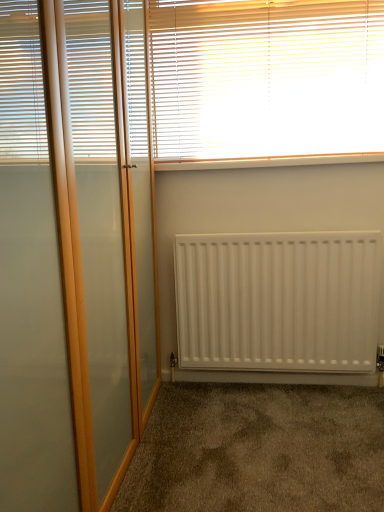
Question: From a real-world perspective, is brown carpet at lower center positioned under white matte radiator at center based on gravity?

Choices:
 (A) no
 (B) yes

Answer: (B)

Question: Does brown carpet at lower center have a greater height compared to white matte radiator at center?

Choices:
 (A) no
 (B) yes

Answer: (A)

Question: Does brown carpet at lower center lie in front of white matte radiator at center?

Choices:
 (A) no
 (B) yes

Answer: (B)

Question: Is brown carpet at lower center facing away from white matte radiator at center?

Choices:
 (A) yes
 (B) no

Answer: (B)

Question: Can you confirm if brown carpet at lower center is shorter than white matte radiator at center?

Choices:
 (A) no
 (B) yes

Answer: (B)

Question: Does point (256, 303) appear closer or farther from the camera than point (157, 162)?

Choices:
 (A) closer
 (B) farther

Answer: (A)

Question: From a real-world perspective, is white matte radiator at center positioned above or below white plastic window sill at upper center?

Choices:
 (A) above
 (B) below

Answer: (B)

Question: From their relative heights in the image, would you say white matte radiator at center is taller or shorter than white plastic window sill at upper center?

Choices:
 (A) short
 (B) tall

Answer: (B)

Question: Considering the positions of white matte radiator at center and white plastic window sill at upper center in the image, is white matte radiator at center bigger or smaller than white plastic window sill at upper center?

Choices:
 (A) big
 (B) small

Answer: (A)

Question: In the image, is brown carpet at lower center positioned in front of or behind white plastic window sill at upper center?

Choices:
 (A) front
 (B) behind

Answer: (A)

Question: From a real-world perspective, is brown carpet at lower center above or below white plastic window sill at upper center?

Choices:
 (A) below
 (B) above

Answer: (A)

Question: Is brown carpet at lower center taller or shorter than white plastic window sill at upper center?

Choices:
 (A) tall
 (B) short

Answer: (B)

Question: Considering the positions of brown carpet at lower center and white plastic window sill at upper center in the image, is brown carpet at lower center wider or thinner than white plastic window sill at upper center?

Choices:
 (A) thin
 (B) wide

Answer: (B)

Question: Based on their sizes in the image, would you say white plastic window sill at upper center is bigger or smaller than white wooden blinds at upper center?

Choices:
 (A) small
 (B) big

Answer: (A)

Question: Is white plastic window sill at upper center spatially inside white wooden blinds at upper center, or outside of it?

Choices:
 (A) inside
 (B) outside

Answer: (B)